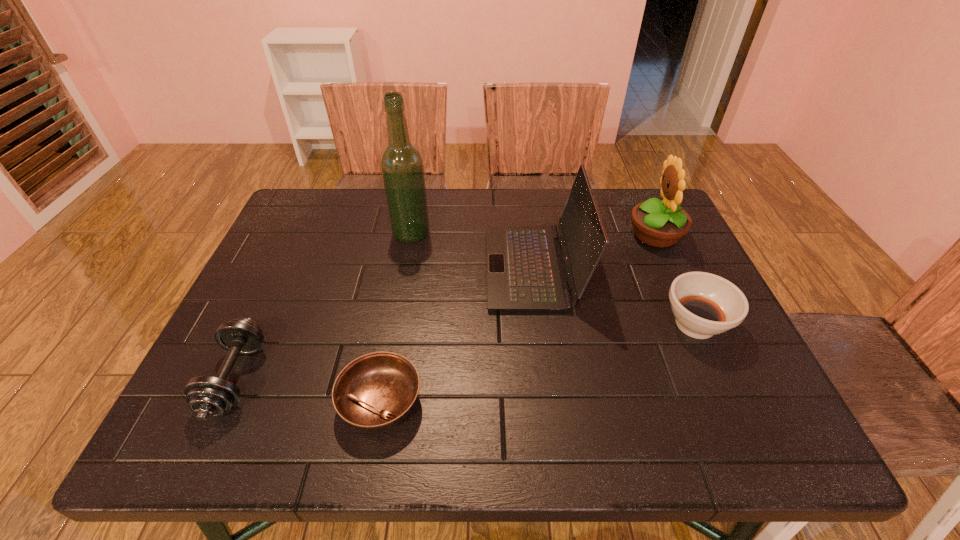
Locate an element on the screen. Image resolution: width=960 pixels, height=540 pixels. laptop computer at the far edge is located at coordinates (525, 269).

The width and height of the screenshot is (960, 540). Find the location of `dumbbell situated at the near edge`. dumbbell situated at the near edge is located at coordinates (207, 396).

Where is `soup bowl that is positioned at the near edge`? The width and height of the screenshot is (960, 540). soup bowl that is positioned at the near edge is located at coordinates (375, 392).

At what (x,y) coordinates should I click in order to perform the action: click on object that is at the left edge. Please return your answer as a coordinate pair (x, y). This screenshot has width=960, height=540. Looking at the image, I should click on (207, 396).

Identify the location of sunflower situated at the right edge. (659, 224).

Find the location of a particular element. The image size is (960, 540). soup bowl that is at the right edge is located at coordinates (704, 304).

The image size is (960, 540). Identify the location of object present at the near left corner. (207, 396).

You are a GUI agent. You are given a task and a screenshot of the screen. Output one action in this format:
    pyautogui.click(x=<x>, y=<y>)
    Task: Click on the object that is at the far right corner
    
    Given the screenshot: What is the action you would take?
    pyautogui.click(x=659, y=224)

In the image, there is a desktop. Where is `vacant area at the far edge`? vacant area at the far edge is located at coordinates (476, 217).

I want to click on free space at the near edge of the desktop, so click(306, 424).